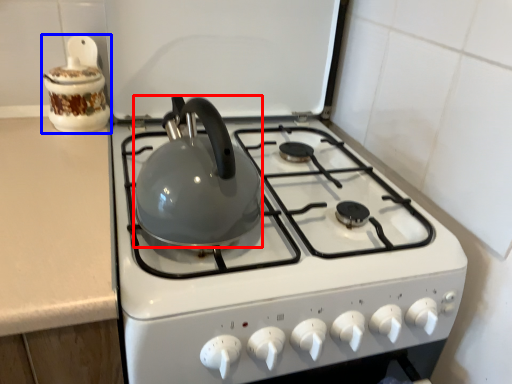
Question: Which object appears closest to the camera in this image, kettle (highlighted by a red box) or kitchen appliance (highlighted by a blue box)?

Choices:
 (A) kettle
 (B) kitchen appliance

Answer: (A)